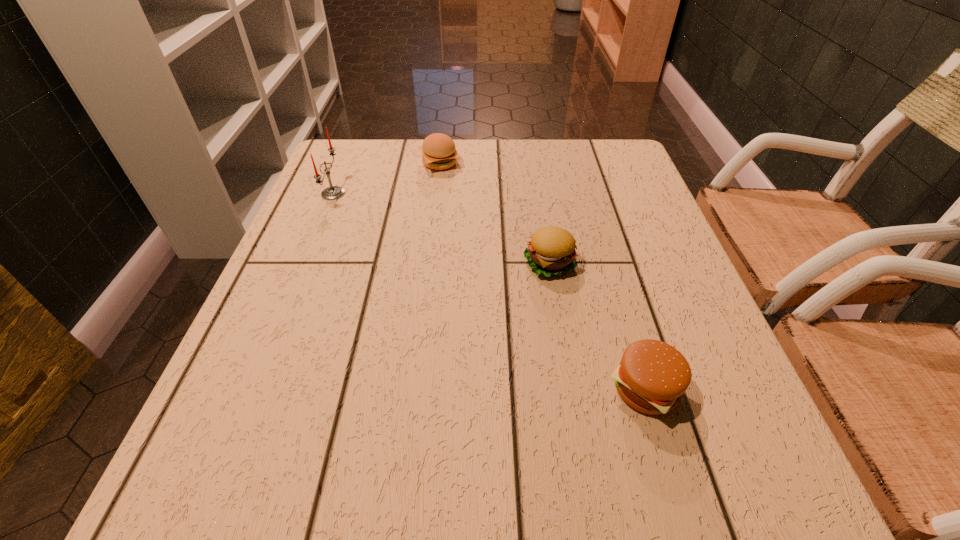
I want to click on candle, so click(x=333, y=192).

Identify the location of the third nearest object. click(333, 192).

At what (x,y) coordinates should I click in order to perform the action: click on the farthest hamburger. Please return your answer as a coordinate pair (x, y). This screenshot has width=960, height=540. Looking at the image, I should click on click(439, 152).

The width and height of the screenshot is (960, 540). In order to click on the farthest object in this screenshot , I will do `click(439, 152)`.

Identify the location of the third farthest object. (551, 251).

Find the location of a particular element. This screenshot has height=540, width=960. the third object from left to right is located at coordinates (551, 251).

The image size is (960, 540). In order to click on the nearest hamburger in this screenshot , I will do (652, 376).

I want to click on the rightmost hamburger, so click(652, 376).

At what (x,y) coordinates should I click in order to perform the action: click on vacant space located 0.290m on the front-facing side of the second farthest object. Please return your answer as a coordinate pair (x, y). Looking at the image, I should click on (465, 193).

You are a GUI agent. You are given a task and a screenshot of the screen. Output one action in this format:
    pyautogui.click(x=<x>, y=<y>)
    Task: Click on the vacant position located on the right of the leftmost hamburger
    
    Given the screenshot: What is the action you would take?
    pyautogui.click(x=540, y=163)